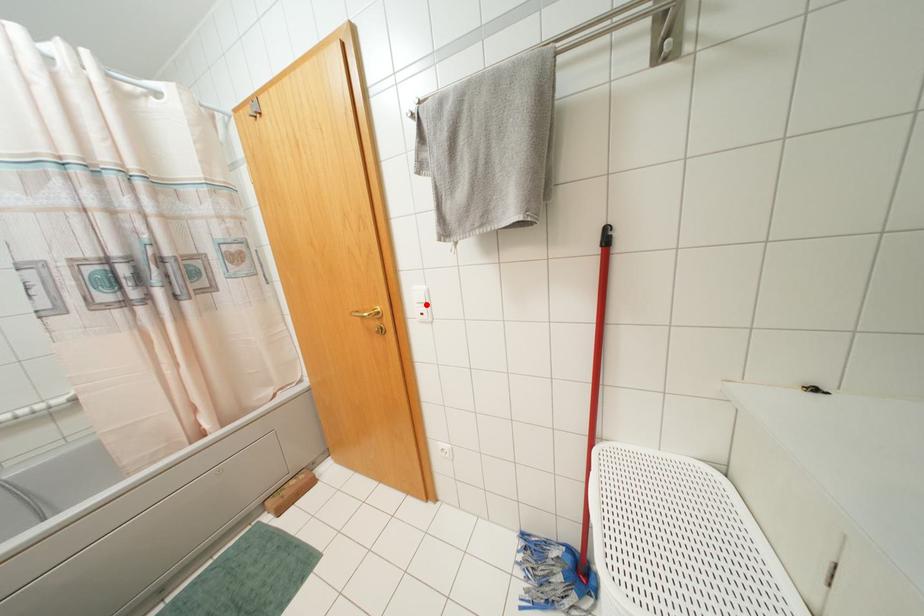
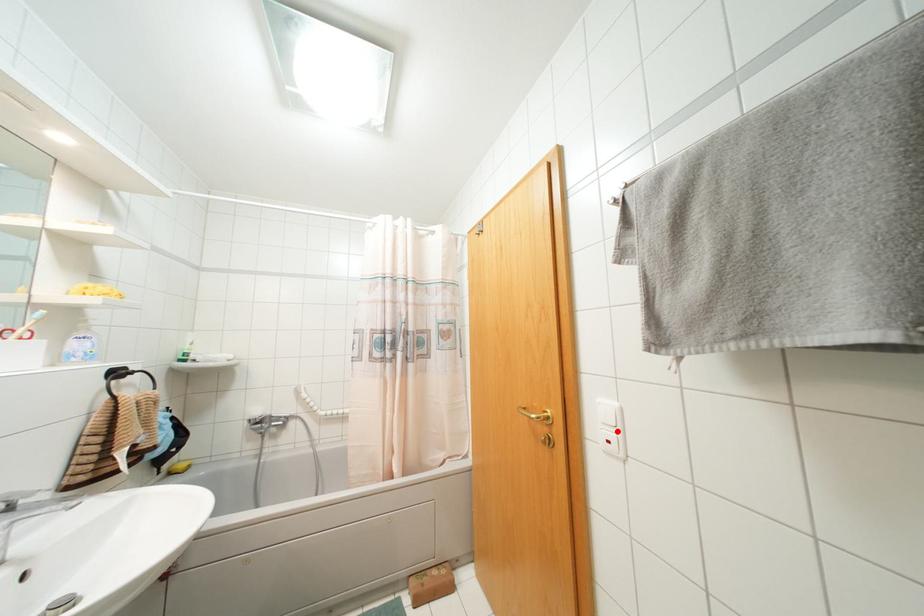
I am providing you with two images of the same scene from different viewpoints. A red point is marked on the first image and another point is marked on the second image. Does the point marked in image1 correspond to the same location as the one in image2?

Yes